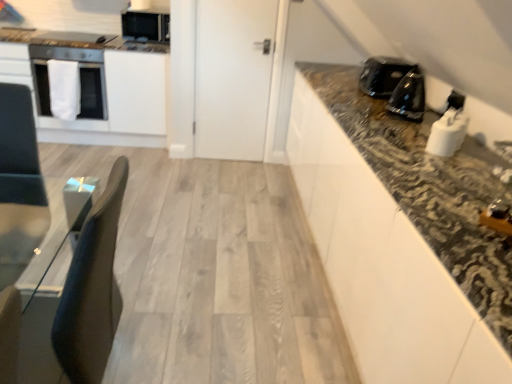
Question: From a real-world perspective, is matte black microwave at upper left, which is the second appliance from left to right, on white glossy oven at left?

Choices:
 (A) no
 (B) yes

Answer: (B)

Question: Does matte black microwave at upper left, which ranks as the fourth appliance in front-to-back order, turn towards white glossy oven at left?

Choices:
 (A) yes
 (B) no

Answer: (B)

Question: Could white glossy oven at left be considered to be inside matte black microwave at upper left, placed as the 1th appliance when sorted from back to front?

Choices:
 (A) yes
 (B) no

Answer: (B)

Question: Does matte black microwave at upper left, placed as the 1th appliance when sorted from back to front, come in front of white glossy oven at left?

Choices:
 (A) no
 (B) yes

Answer: (A)

Question: Is matte black microwave at upper left, acting as the 3th appliance starting from the right, outside of white glossy oven at left?

Choices:
 (A) no
 (B) yes

Answer: (B)

Question: Would you say white glossy toaster at upper right, the fourth appliance viewed from the top, is inside or outside white matte oven at left?

Choices:
 (A) inside
 (B) outside

Answer: (B)

Question: From a real-world perspective, relative to white matte oven at left, is white glossy toaster at upper right, marked as the fourth appliance in a left-to-right arrangement, vertically above or below?

Choices:
 (A) below
 (B) above

Answer: (B)

Question: In the image, is white glossy toaster at upper right, the fourth appliance viewed from the top, positioned in front of or behind white matte oven at left?

Choices:
 (A) front
 (B) behind

Answer: (A)

Question: In the image, is white glossy toaster at upper right, which is the 1th appliance in front-to-back order, on the left side or the right side of white matte oven at left?

Choices:
 (A) right
 (B) left

Answer: (A)

Question: Considering the positions of white matte oven at left and white glossy oven at left in the image, is white matte oven at left taller or shorter than white glossy oven at left?

Choices:
 (A) short
 (B) tall

Answer: (A)

Question: From the image's perspective, is white matte oven at left located above or below white glossy oven at left?

Choices:
 (A) below
 (B) above

Answer: (B)

Question: Is point (71, 59) positioned closer to the camera than point (115, 132)?

Choices:
 (A) farther
 (B) closer

Answer: (B)

Question: In the image, is white matte oven at left on the left side or the right side of white glossy oven at left?

Choices:
 (A) right
 (B) left

Answer: (A)

Question: Considering the positions of white matte oven at left and black granite countertop at upper right in the image, is white matte oven at left wider or thinner than black granite countertop at upper right?

Choices:
 (A) thin
 (B) wide

Answer: (B)

Question: From the image's perspective, is white matte oven at left positioned above or below black granite countertop at upper right?

Choices:
 (A) below
 (B) above

Answer: (B)